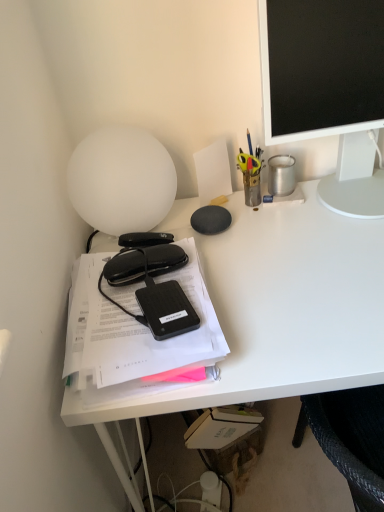
Identify the location of free area in between black matte hardcover at left and metallic silver pen holder at upper right, placed as the 1th stationery when sorted from right to left. (242, 257).